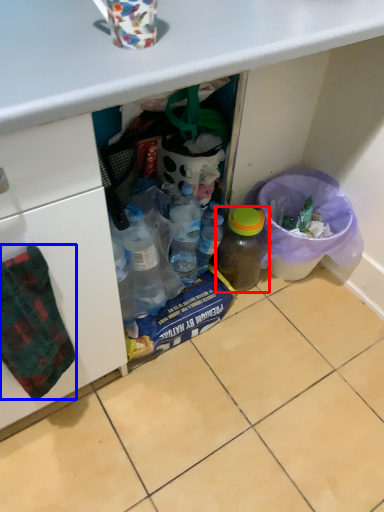
Question: Which of the following is the closest to the observer, bottle (highlighted by a red box) or blanket (highlighted by a blue box)?

Choices:
 (A) bottle
 (B) blanket

Answer: (B)